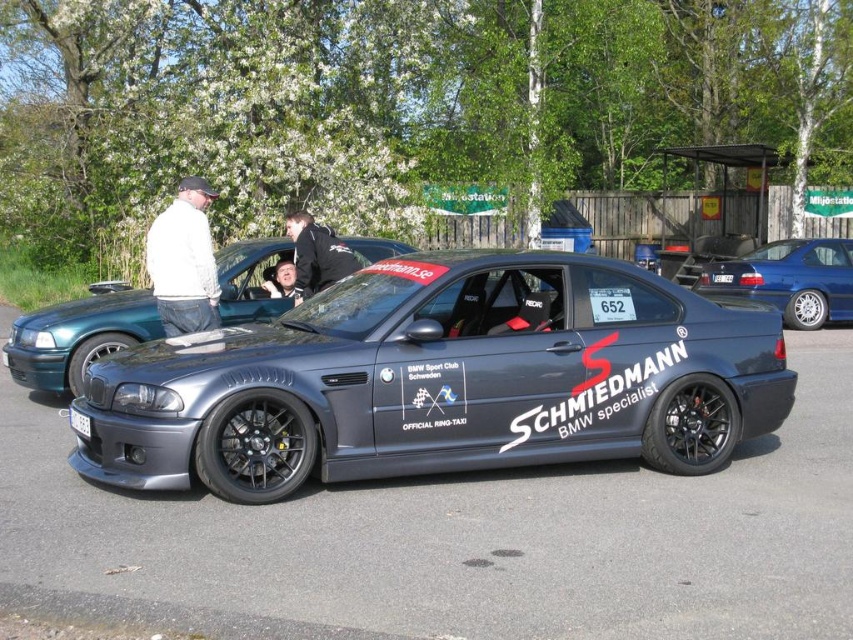
Question: Among these points, which one is farthest from the camera?

Choices:
 (A) (413, 288)
 (B) (720, 282)

Answer: (B)

Question: Which point appears farthest from the camera in this image?

Choices:
 (A) (711, 250)
 (B) (42, 376)
 (C) (791, 316)
 (D) (341, 259)

Answer: (A)

Question: Among these points, which one is farthest from the camera?

Choices:
 (A) (718, 273)
 (B) (325, 240)

Answer: (A)

Question: Is white plastic license plate at lower left above white plastic license plate at center?

Choices:
 (A) no
 (B) yes

Answer: (A)

Question: Can you confirm if satin black car at center is wider than metallic gray car at center?

Choices:
 (A) yes
 (B) no

Answer: (B)

Question: Is metallic blue car at center bigger than black leather jacket at center?

Choices:
 (A) no
 (B) yes

Answer: (B)